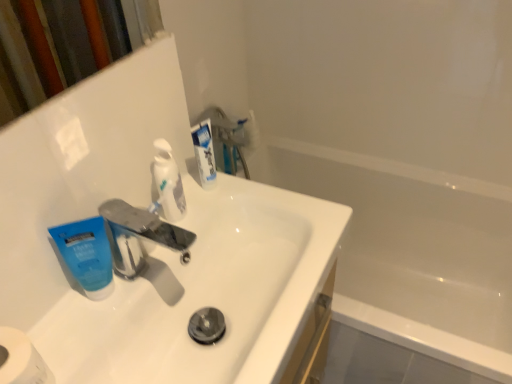
The height and width of the screenshot is (384, 512). I want to click on empty space that is ontop of white glossy sink at center (from a real-world perspective), so click(x=216, y=304).